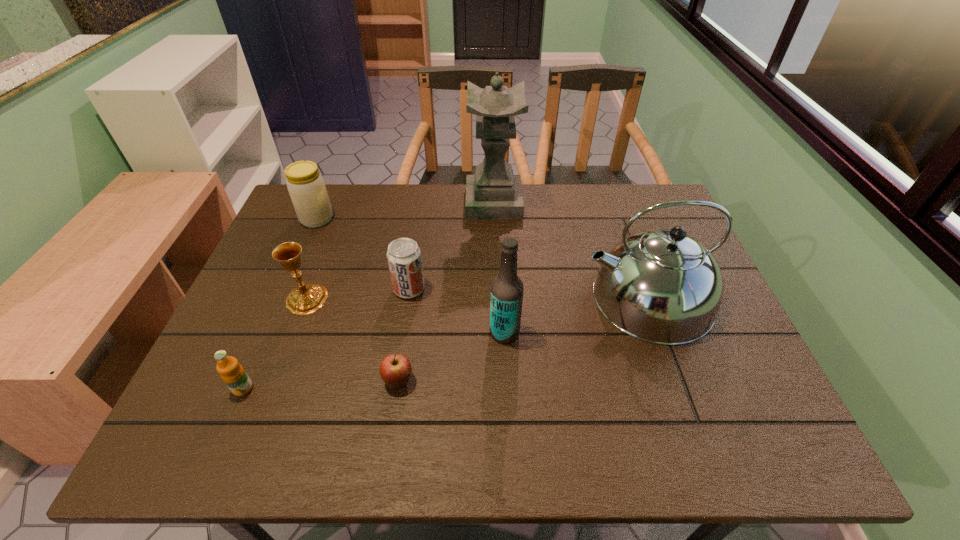
At what (x,y) coordinates should I click in order to perform the action: click on sculpture. Please return your answer as a coordinate pair (x, y). Looking at the image, I should click on (493, 193).

The height and width of the screenshot is (540, 960). In order to click on the rightmost object in this screenshot , I will do `click(661, 286)`.

Locate an element on the screen. This screenshot has height=540, width=960. beer bottle is located at coordinates (507, 289).

The image size is (960, 540). What are the coordinates of `jar` in the screenshot? It's located at [307, 189].

Locate an element on the screen. chalice is located at coordinates (306, 299).

Image resolution: width=960 pixels, height=540 pixels. Identify the location of soda can. (404, 258).

The image size is (960, 540). What are the coordinates of `orange juice` in the screenshot? It's located at (233, 374).

The height and width of the screenshot is (540, 960). Find the location of `apple`. apple is located at coordinates (395, 370).

This screenshot has height=540, width=960. Find the location of `free space located 0.280m at the front opening of the sculpture`. free space located 0.280m at the front opening of the sculpture is located at coordinates (378, 203).

In order to click on free spot located at the front opening of the sculpture in this screenshot , I will do `click(381, 203)`.